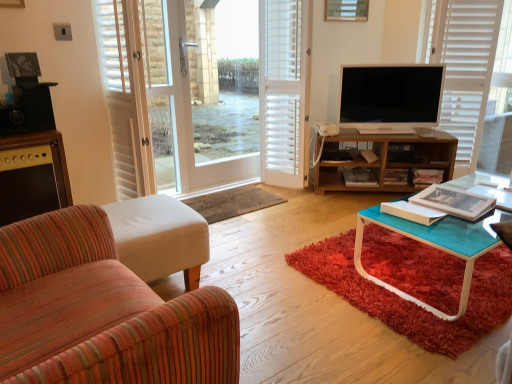
Measure the distance between rug at center and camera.

rug at center is 2.66 meters from camera.

What are the coordinates of `rug at center` in the screenshot? It's located at (232, 202).

The height and width of the screenshot is (384, 512). What do you see at coordinates (160, 238) in the screenshot?
I see `striped fabric armchair at left, which is counted as the first chair, starting from the back` at bounding box center [160, 238].

This screenshot has width=512, height=384. What do you see at coordinates (464, 68) in the screenshot?
I see `white wooden blind at upper right` at bounding box center [464, 68].

The image size is (512, 384). What are the coordinates of `wooden picture frame at upper center` in the screenshot? It's located at (346, 10).

Describe the element at coordinates (391, 96) in the screenshot. The height and width of the screenshot is (384, 512). I see `flat screen tv at center` at that location.

Where is `white plastic corded phone at center`? This screenshot has width=512, height=384. white plastic corded phone at center is located at coordinates (326, 129).

Find the location of a particular element. This screenshot has height=384, width=512. wooden shelf at center is located at coordinates (383, 158).

Identify the location of rug at center. This screenshot has width=512, height=384. (232, 202).

From the image's perspective, is white plastic corded phone at center positioned above or below white wooden shutter at center?

Clearly, from the image's perspective, white plastic corded phone at center is below white wooden shutter at center.

Looking at this image, who is smaller, white plastic corded phone at center or white wooden shutter at center?

With smaller size is white plastic corded phone at center.

Who is shorter, white plastic corded phone at center or white wooden shutter at center?

Standing shorter between the two is white plastic corded phone at center.

Looking at this image, is white plastic corded phone at center to the right of white wooden shutter at center from the viewer's perspective?

Correct, you'll find white plastic corded phone at center to the right of white wooden shutter at center.

Is striped fabric armchair at left, which is counted as the first chair, starting from the back, positioned with its back to shaggy red rug at lower right?

No, striped fabric armchair at left, which is counted as the first chair, starting from the back,'s orientation is not away from shaggy red rug at lower right.

Between striped fabric armchair at left, which is counted as the first chair, starting from the back, and shaggy red rug at lower right, which one has more height?

striped fabric armchair at left, which is counted as the first chair, starting from the back.

Looking at this image, considering the relative positions of striped fabric armchair at left, which is counted as the first chair, starting from the back, and shaggy red rug at lower right in the image provided, is striped fabric armchair at left, which is counted as the first chair, starting from the back, to the left or to the right of shaggy red rug at lower right?

striped fabric armchair at left, which is counted as the first chair, starting from the back, is to the left of shaggy red rug at lower right.

Can you confirm if flat screen tv at center is positioned to the left of striped fabric armchair at left, positioned as the 2th chair in front-to-back order?

No, flat screen tv at center is not to the left of striped fabric armchair at left, positioned as the 2th chair in front-to-back order.

From a real-world perspective, is flat screen tv at center above or below striped fabric armchair at left, which is counted as the first chair, starting from the back?

flat screen tv at center is situated higher than striped fabric armchair at left, which is counted as the first chair, starting from the back, in the real world.

Looking at their sizes, would you say flat screen tv at center is wider or thinner than striped fabric armchair at left, positioned as the 2th chair in front-to-back order?

Considering their sizes, flat screen tv at center looks slimmer than striped fabric armchair at left, positioned as the 2th chair in front-to-back order.

Would you say flat screen tv at center is a long distance from striped fabric armchair at left, positioned as the 2th chair in front-to-back order?

Yes.

Is white wood screen door at center inside or outside of wooden shelf at center?

white wood screen door at center is outside wooden shelf at center.

Is point (146, 171) closer to camera compared to point (401, 191)?

Yes, it is.

From the image's perspective, between white wood screen door at center and wooden shelf at center, who is located below?

wooden shelf at center, from the image's perspective.

Considering the relative positions of white wood screen door at center and wooden shelf at center in the image provided, is white wood screen door at center behind wooden shelf at center?

No, it is not.

Is shaggy red rug at lower right taller or shorter than wooden shelf at center?

Clearly, shaggy red rug at lower right is shorter compared to wooden shelf at center.

Is shaggy red rug at lower right aimed at wooden shelf at center?

No, shaggy red rug at lower right is not facing towards wooden shelf at center.

Between shaggy red rug at lower right and wooden shelf at center, which one has larger size?

wooden shelf at center.

Based on the photo, from the image's perspective, who appears lower, shaggy red rug at lower right or wooden shelf at center?

shaggy red rug at lower right appears lower in the image.

From the image's perspective, would you say white wooden blind at upper right is shown under shaggy red rug at lower right?

Incorrect, from the image's perspective, white wooden blind at upper right is higher than shaggy red rug at lower right.

Between white wooden blind at upper right and shaggy red rug at lower right, which one has larger width?

Wider between the two is shaggy red rug at lower right.

Considering the relative sizes of white wooden blind at upper right and shaggy red rug at lower right in the image provided, is white wooden blind at upper right taller than shaggy red rug at lower right?

Correct, white wooden blind at upper right is much taller as shaggy red rug at lower right.

Which of these two, white wood screen door at center or rug at center, stands shorter?

rug at center.

From the image's perspective, is white wood screen door at center under rug at center?

No, from the image's perspective, white wood screen door at center is not below rug at center.

Considering the positions of objects white wood screen door at center and rug at center in the image provided, who is more to the left, white wood screen door at center or rug at center?

Positioned to the left is white wood screen door at center.

Is white wood screen door at center far from rug at center?

Actually, white wood screen door at center and rug at center are a little close together.

Locate an element on the screen. corded phone behind the white wooden shutter at center is located at coordinates (326, 129).

You are a GUI agent. You are given a task and a screenshot of the screen. Output one action in this format:
    pyautogui.click(x=<x>, y=<y>)
    Task: Click on the 2nd chair above the shaggy red rug at lower right (from the image's perspective)
    
    Given the screenshot: What is the action you would take?
    pyautogui.click(x=160, y=238)

Based on their spatial positions, is wooden shelf at center or striped fabric armchair at left, the 2th chair positioned from the back, closer to white wood screen door at center?

wooden shelf at center is closer to white wood screen door at center.

From the image, which object appears to be farther from wooden picture frame at upper center, black matte speaker at upper left or white wooden blind at upper right?

Based on the image, black matte speaker at upper left appears to be further to wooden picture frame at upper center.

Which object lies further to the anchor point striped fabric armchair at left, which is counted as the first chair, starting from the back, matte black speaker at left or wooden picture frame at upper center?

The object further to striped fabric armchair at left, which is counted as the first chair, starting from the back, is wooden picture frame at upper center.

Looking at this image, considering their positions, is white wood screen door at center positioned closer to flat screen tv at center than matte black speaker at left?

The object closer to flat screen tv at center is white wood screen door at center.

From the image, which object appears to be nearer to black matte speaker at upper left, white wood screen door at center or rug at center?

white wood screen door at center lies closer to black matte speaker at upper left than the other object.

Based on their spatial positions, is white wooden blind at upper right or striped fabric armchair at left, which is counted as the first chair, starting from the back, closer to white plastic corded phone at center?

white wooden blind at upper right is positioned closer to the anchor white plastic corded phone at center.

Estimate the real-world distances between objects in this image. Which object is closer to white wooden blind at upper right, white wooden shutter at center or shaggy red rug at lower right?

→ white wooden shutter at center.

From the image, which object appears to be nearer to striped fabric armchair at left, the 2th chair positioned from the back, black matte speaker at upper left or white wood screen door at center?

black matte speaker at upper left.

Locate an element on the screen. The image size is (512, 384). loudspeaker between striped fabric armchair at left, the 2th chair positioned from the back, and wooden shelf at center in the front-back direction is located at coordinates (28, 110).

The width and height of the screenshot is (512, 384). I want to click on chair between striped fabric armchair at left, the 2th chair positioned from the back, and black matte speaker at upper left from front to back, so click(160, 238).

Find the location of `screen door between matte black speaker at left and wooden shelf at center from left to right`. screen door between matte black speaker at left and wooden shelf at center from left to right is located at coordinates (134, 93).

I want to click on chair between striped fabric armchair at left, acting as the 1th chair starting from the front, and wooden shelf at center in the front-back direction, so click(160, 238).